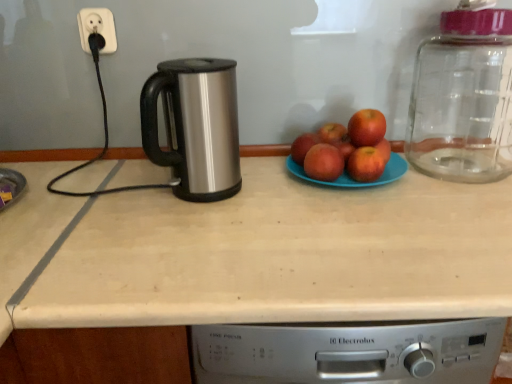
I want to click on vacant region to the left of blue matte plate at center, so click(x=260, y=186).